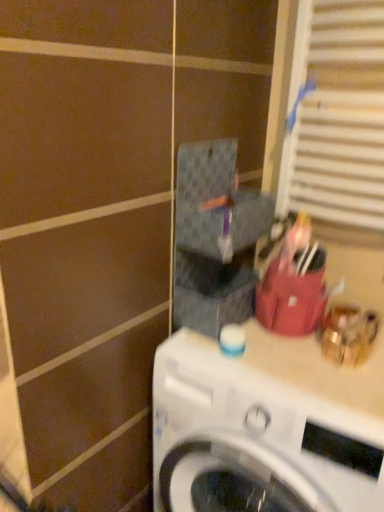
Question: In terms of height, does white glossy washing machine at center look taller or shorter compared to white textured blinds at upper right?

Choices:
 (A) short
 (B) tall

Answer: (B)

Question: Is white glossy washing machine at center situated inside white textured blinds at upper right or outside?

Choices:
 (A) outside
 (B) inside

Answer: (A)

Question: In terms of width, does white glossy washing machine at center look wider or thinner when compared to white textured blinds at upper right?

Choices:
 (A) wide
 (B) thin

Answer: (A)

Question: Considering their positions, is white textured blinds at upper right located in front of or behind white glossy washing machine at center?

Choices:
 (A) front
 (B) behind

Answer: (B)

Question: Considering the positions of white textured blinds at upper right and white glossy washing machine at center in the image, is white textured blinds at upper right taller or shorter than white glossy washing machine at center?

Choices:
 (A) short
 (B) tall

Answer: (A)

Question: From the image's perspective, relative to white glossy washing machine at center, is white textured blinds at upper right above or below?

Choices:
 (A) below
 (B) above

Answer: (B)

Question: Is white textured blinds at upper right to the left or to the right of white glossy washing machine at center in the image?

Choices:
 (A) right
 (B) left

Answer: (A)